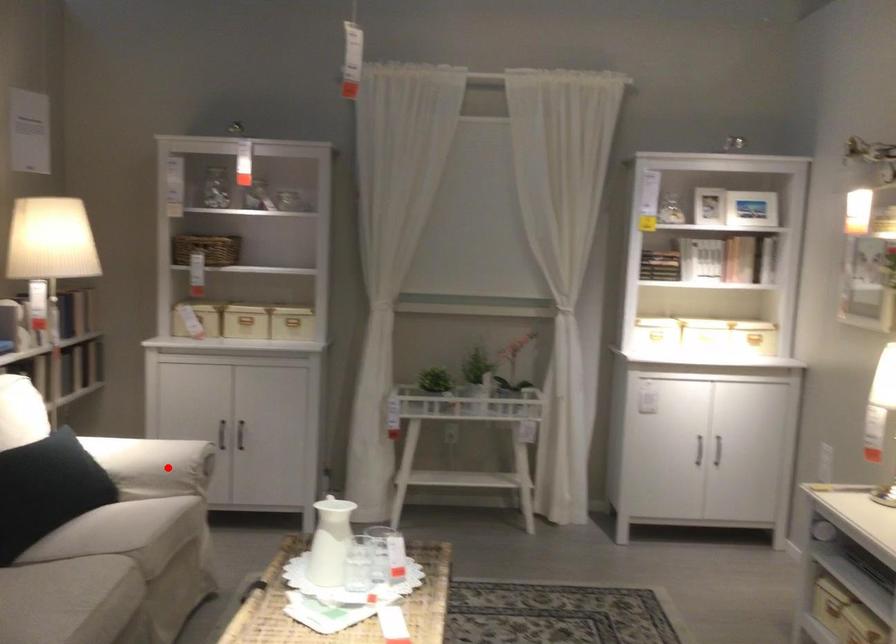
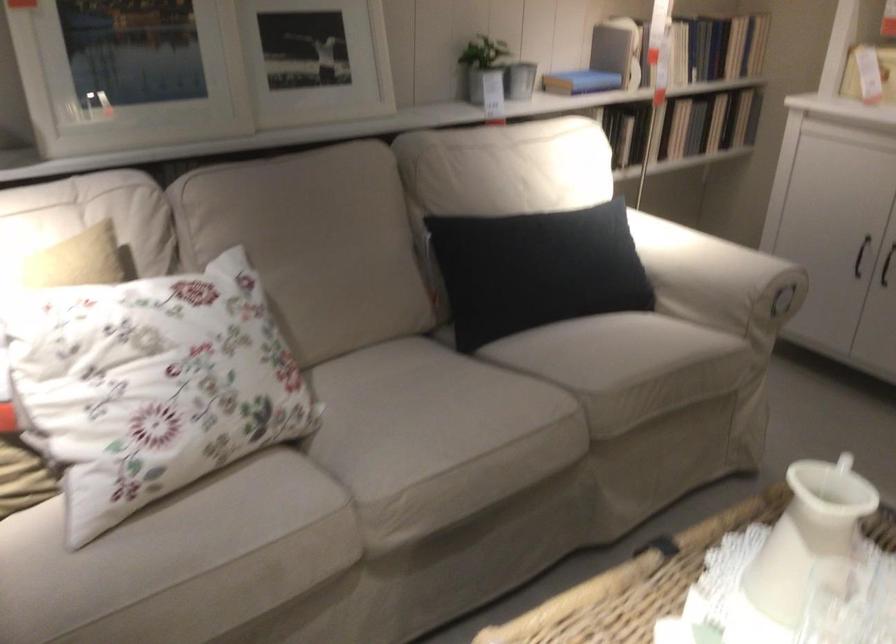
Question: I am providing you with two images of the same scene from different viewpoints. Given a red point in image1, look at the same physical point in image2. Is it:

Choices:
 (A) Closer to the viewpoint
 (B) Farther from the viewpoint

Answer: (A)